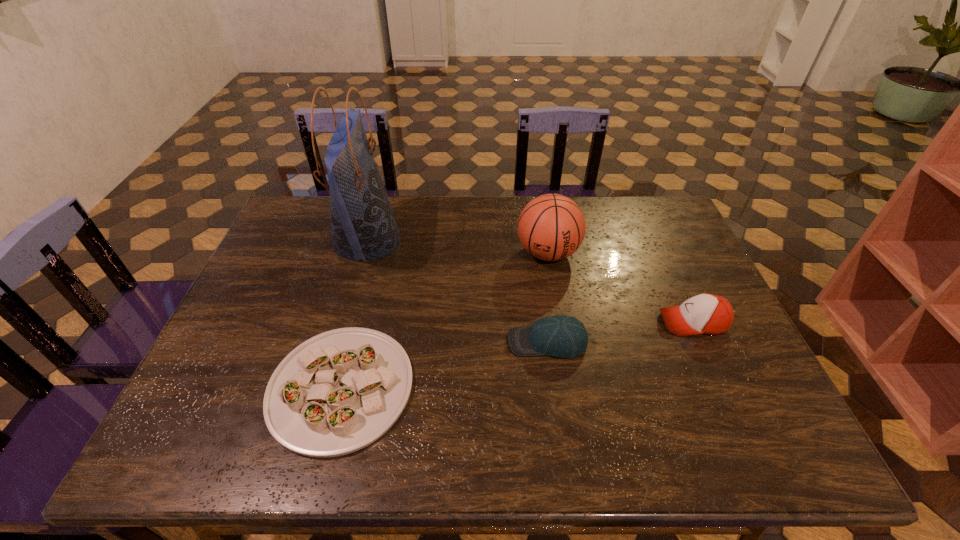
You are a GUI agent. You are given a task and a screenshot of the screen. Output one action in this format:
    pyautogui.click(x=<x>, y=<y>)
    Task: Click on the blank region between the shorter baseball cap and the second tallest object
    Image resolution: width=960 pixels, height=540 pixels.
    Given the screenshot: What is the action you would take?
    (547, 298)

You are a GUI agent. You are given a task and a screenshot of the screen. Output one action in this format:
    pyautogui.click(x=<x>, y=<y>)
    Task: Click on the vacant area between the right baseball cap and the shorter baseball cap
    Image resolution: width=960 pixels, height=540 pixels.
    Given the screenshot: What is the action you would take?
    pyautogui.click(x=620, y=332)

Choose which object is the second nearest neighbor to the basketball. Please provide its 2D coordinates. Your answer should be formatted as a tuple, i.e. [(x, y)], where the tuple contains the x and y coordinates of a point satisfying the conditions above.

[(709, 314)]

Identify which object is located as the nearest to the rightmost object. Please provide its 2D coordinates. Your answer should be formatted as a tuple, i.e. [(x, y)], where the tuple contains the x and y coordinates of a point satisfying the conditions above.

[(562, 336)]